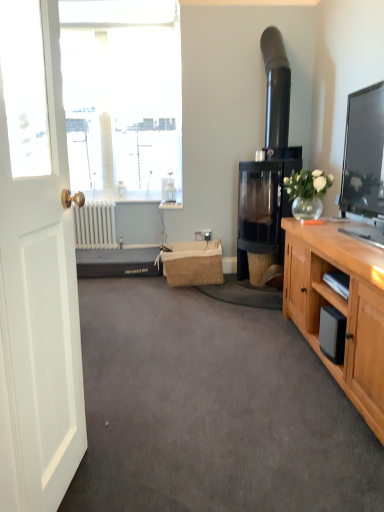
Question: Is burlap picnic basket at center shorter than black glass fireplace at center-right?

Choices:
 (A) no
 (B) yes

Answer: (B)

Question: Is burlap picnic basket at center located outside black glass fireplace at center-right?

Choices:
 (A) yes
 (B) no

Answer: (A)

Question: Are burlap picnic basket at center and black glass fireplace at center-right making contact?

Choices:
 (A) no
 (B) yes

Answer: (A)

Question: Can you confirm if burlap picnic basket at center is positioned to the left of black glass fireplace at center-right?

Choices:
 (A) yes
 (B) no

Answer: (A)

Question: Can you confirm if burlap picnic basket at center is positioned to the right of black glass fireplace at center-right?

Choices:
 (A) no
 (B) yes

Answer: (A)

Question: Is white matte door at left in front of or behind black glass fireplace at center-right in the image?

Choices:
 (A) front
 (B) behind

Answer: (A)

Question: From their relative heights in the image, would you say white matte door at left is taller or shorter than black glass fireplace at center-right?

Choices:
 (A) short
 (B) tall

Answer: (A)

Question: Do you think white matte door at left is within black glass fireplace at center-right, or outside of it?

Choices:
 (A) inside
 (B) outside

Answer: (B)

Question: Considering the positions of point (54, 84) and point (273, 226), is point (54, 84) closer or farther from the camera than point (273, 226)?

Choices:
 (A) closer
 (B) farther

Answer: (A)

Question: In terms of height, does gray carpet at center look taller or shorter compared to black glass fireplace at center-right?

Choices:
 (A) short
 (B) tall

Answer: (A)

Question: Relative to black glass fireplace at center-right, is gray carpet at center in front or behind?

Choices:
 (A) front
 (B) behind

Answer: (A)

Question: From a real-world perspective, relative to black glass fireplace at center-right, is gray carpet at center vertically above or below?

Choices:
 (A) above
 (B) below

Answer: (B)

Question: Is gray carpet at center bigger or smaller than black glass fireplace at center-right?

Choices:
 (A) small
 (B) big

Answer: (A)

Question: Is gray carpet at center inside or outside of white matte door at left?

Choices:
 (A) inside
 (B) outside

Answer: (B)

Question: Relative to white matte door at left, is gray carpet at center in front or behind?

Choices:
 (A) front
 (B) behind

Answer: (B)